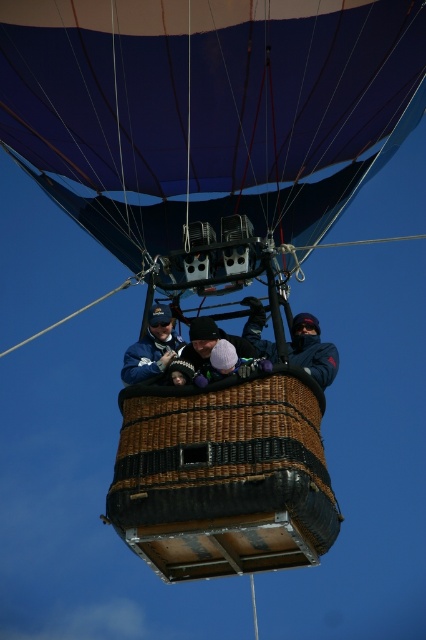
Question: Is blue fabric balloon at upper center smaller than blue fabric jacket at center?

Choices:
 (A) no
 (B) yes

Answer: (A)

Question: Does dark blue fabric at upper center have a smaller size compared to blue fabric jacket at center?

Choices:
 (A) no
 (B) yes

Answer: (B)

Question: Can you confirm if matte blue jacket at center is positioned below blue fabric jacket at center?

Choices:
 (A) yes
 (B) no

Answer: (A)

Question: Which object is closer to the camera taking this photo?

Choices:
 (A) dark blue fabric at upper center
 (B) blue fabric balloon at upper center
 (C) white knit hat at center
 (D) matte blue jacket at center

Answer: (C)

Question: Which point is farther to the camera?

Choices:
 (A) matte blue jacket at center
 (B) blue fabric jacket at center
 (C) dark blue fabric at upper center
 (D) white knit hat at center

Answer: (B)

Question: Among these points, which one is farthest from the camera?

Choices:
 (A) (241, 340)
 (B) (190, 340)

Answer: (A)